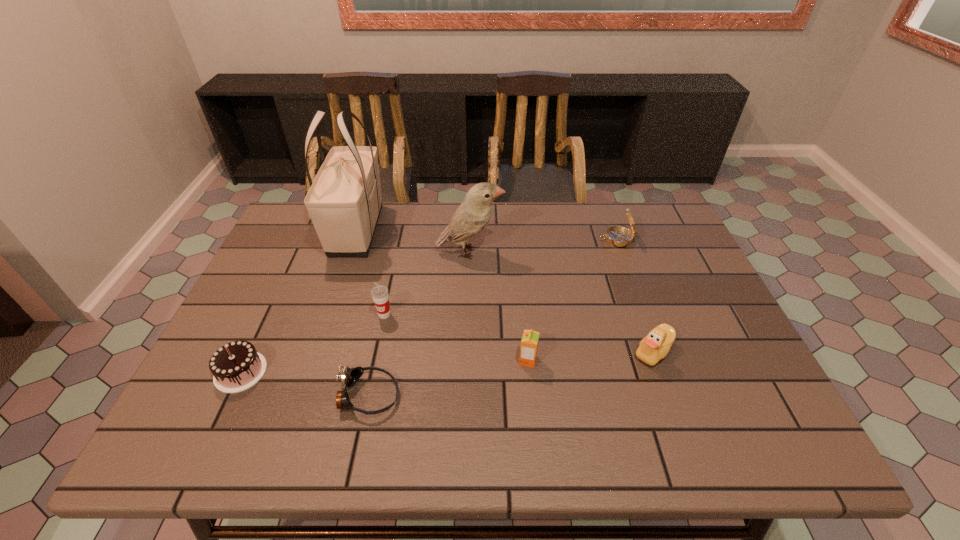
Identify the location of vacant space located 0.300m on the right of the chocolate cake. (396, 372).

The image size is (960, 540). In order to click on vacant point located through the lenses of the shortest object in this screenshot , I will do `click(441, 396)`.

Locate an element on the screen. shopping bag positioned at the far edge is located at coordinates (344, 202).

The height and width of the screenshot is (540, 960). In order to click on bird that is positioned at the far edge in this screenshot , I will do [471, 217].

Identify the location of compass that is positioned at the far edge. This screenshot has height=540, width=960. (618, 236).

This screenshot has width=960, height=540. Find the location of `object at the near edge`. object at the near edge is located at coordinates (349, 376).

This screenshot has width=960, height=540. I want to click on shopping bag located in the left edge section of the desktop, so click(344, 202).

This screenshot has width=960, height=540. What are the coordinates of `chocolate cake that is positioned at the left edge` in the screenshot? It's located at (236, 366).

This screenshot has width=960, height=540. I want to click on object present at the right edge, so click(618, 236).

Locate an element on the screen. object located in the far left corner section of the desktop is located at coordinates (344, 202).